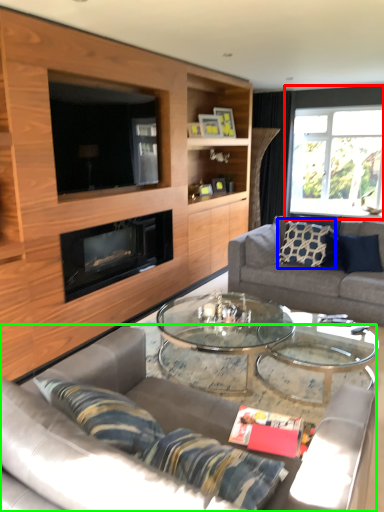
Question: Based on their relative distances, which object is nearer to window (highlighted by a red box)? Choose from pillow (highlighted by a blue box) and studio couch (highlighted by a green box).

Choices:
 (A) pillow
 (B) studio couch

Answer: (A)